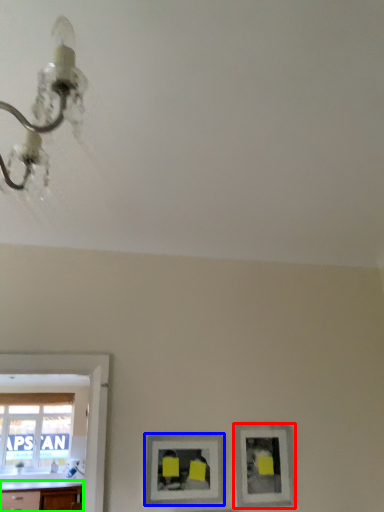
Question: Considering the real-world distances, which object is farthest from picture frame (highlighted by a red box)? picture frame (highlighted by a blue box) or counter top (highlighted by a green box)?

Choices:
 (A) picture frame
 (B) counter top

Answer: (B)